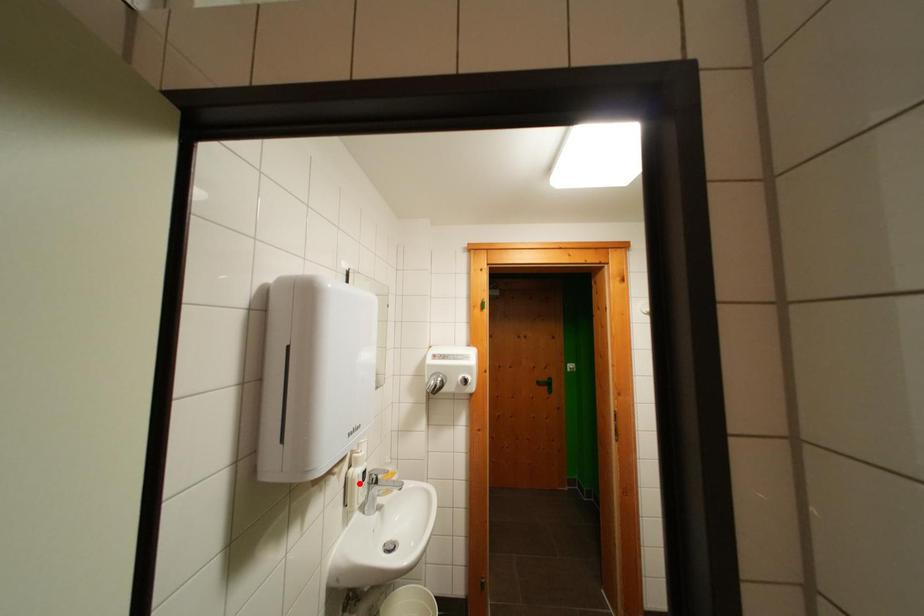
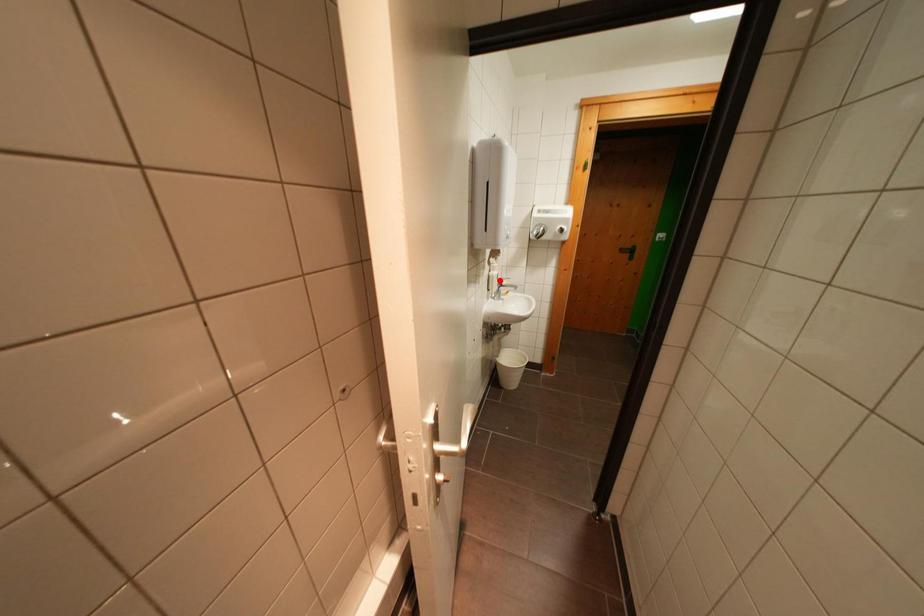
I am providing you with two images of the same scene from different viewpoints. A red point is marked on the first image and another point is marked on the second image. Are the points marked in image1 and image2 representing the same 3D position?

Yes